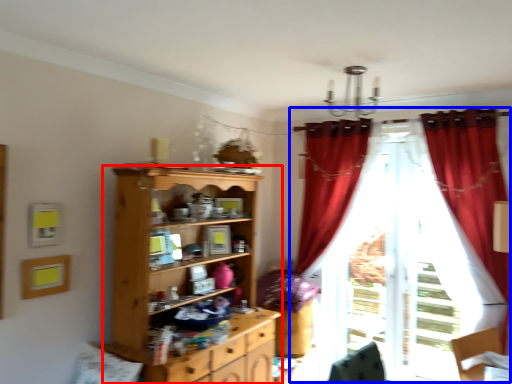
Question: Which object appears farthest to the camera in this image, cupboard (highlighted by a red box) or curtain (highlighted by a blue box)?

Choices:
 (A) cupboard
 (B) curtain

Answer: (B)